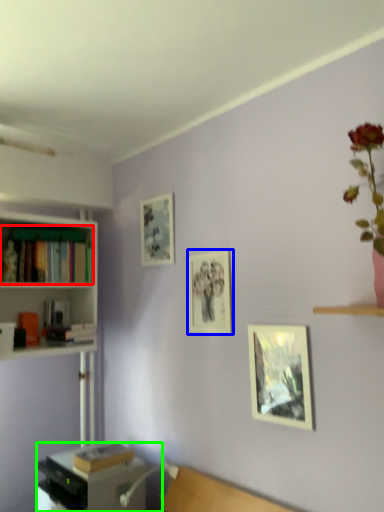
Question: Estimate the real-world distances between objects in this image. Which object is closer to book (highlighted by a red box), picture frame (highlighted by a blue box) or desk (highlighted by a green box)?

Choices:
 (A) picture frame
 (B) desk

Answer: (A)